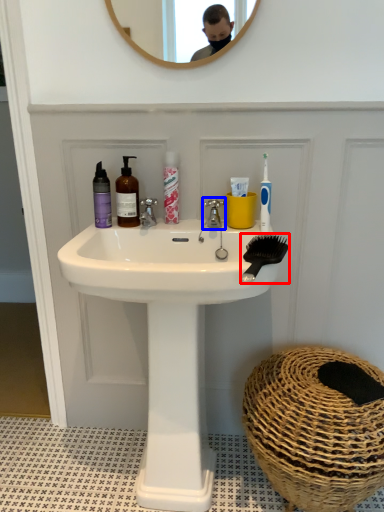
Question: Which point is further to the camera, comb (highlighted by a red box) or tap (highlighted by a blue box)?

Choices:
 (A) comb
 (B) tap

Answer: (B)